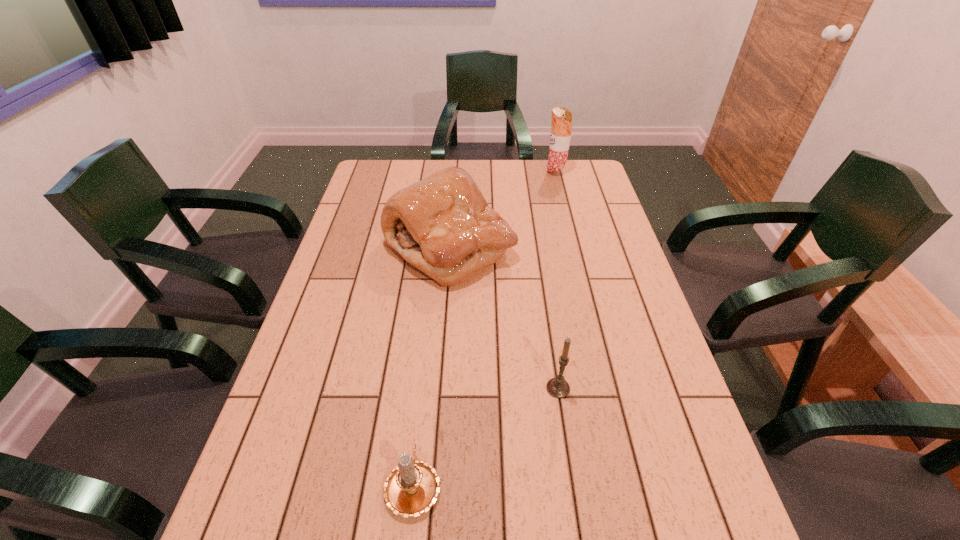
The height and width of the screenshot is (540, 960). I want to click on the rightmost object, so click(561, 126).

Identify the location of the tallest object. (561, 126).

The image size is (960, 540). In order to click on bread in this screenshot , I will do `click(442, 225)`.

You are a GUI agent. You are given a task and a screenshot of the screen. Output one action in this format:
    pyautogui.click(x=<x>, y=<y>)
    Task: Click on the second farthest object
    The height and width of the screenshot is (540, 960).
    Given the screenshot: What is the action you would take?
    pyautogui.click(x=442, y=225)

Where is `the taller candle`? Image resolution: width=960 pixels, height=540 pixels. the taller candle is located at coordinates (558, 387).

This screenshot has width=960, height=540. What are the coordinates of `the third tallest object` in the screenshot? It's located at click(558, 387).

This screenshot has width=960, height=540. I want to click on the nearer candle, so click(412, 487).

Where is `the nearest object`? the nearest object is located at coordinates (412, 487).

At what (x,y) coordinates should I click in order to perform the action: click on vacant area located on the front of the farthest object. Please return your answer as a coordinate pair (x, y). Looking at the image, I should click on (573, 244).

The width and height of the screenshot is (960, 540). I want to click on vacant space located on the filling side of the third shortest object, so click(x=558, y=247).